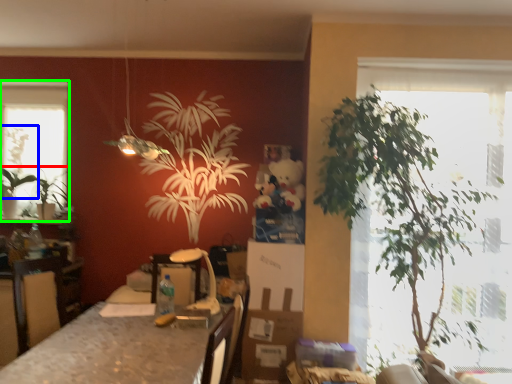
Question: Which object is the closest to the houseplant (highlighted by a red box)? Choose among these: plant (highlighted by a blue box) or window (highlighted by a green box).

Choices:
 (A) plant
 (B) window

Answer: (A)